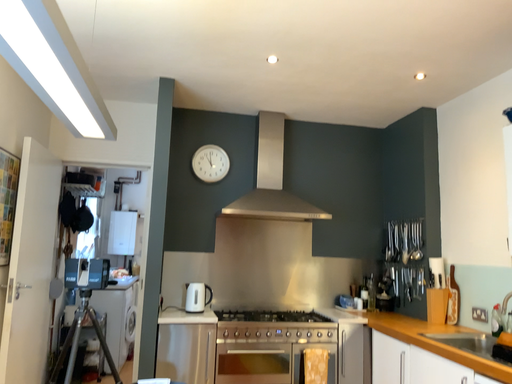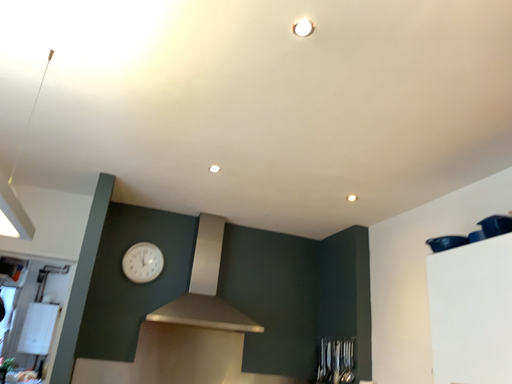
Question: Which way did the camera rotate in the video?

Choices:
 (A) rotated left
 (B) rotated right

Answer: (B)